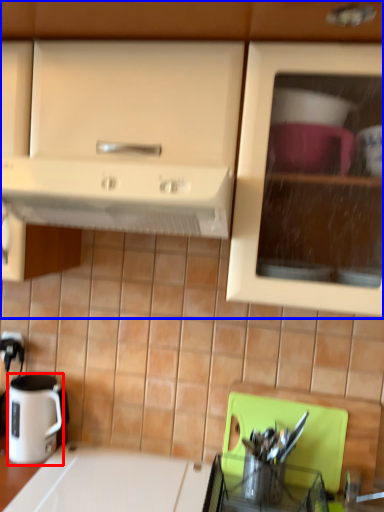
Question: Which object is closer to the camera taking this photo, coffee cup (highlighted by a red box) or cabinetry (highlighted by a blue box)?

Choices:
 (A) coffee cup
 (B) cabinetry

Answer: (B)